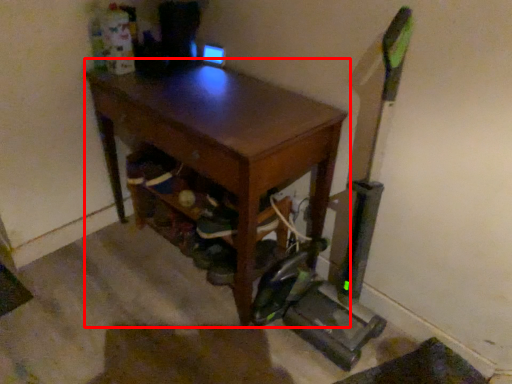
Question: From the image's perspective, where is desk (annotated by the red box) located in relation to shoe in the image?

Choices:
 (A) below
 (B) above

Answer: (B)